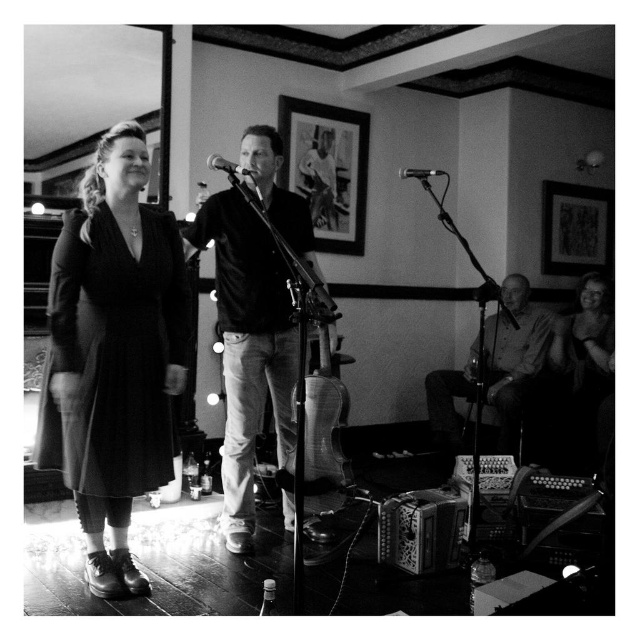
The height and width of the screenshot is (640, 640). What do you see at coordinates (326, 168) in the screenshot?
I see `printed paper picture frame at upper center` at bounding box center [326, 168].

The width and height of the screenshot is (640, 640). I want to click on printed paper picture frame at upper center, so click(326, 168).

How distant is matte black shirt at center from metallic silver picture frame at upper right?

A distance of 2.98 meters exists between matte black shirt at center and metallic silver picture frame at upper right.

Is matte black shirt at center to the right of metallic silver picture frame at upper right from the viewer's perspective?

In fact, matte black shirt at center is to the left of metallic silver picture frame at upper right.

Find the location of a particular element. matte black shirt at center is located at coordinates (248, 348).

Identify the location of matte black shirt at center. This screenshot has height=640, width=640. (248, 348).

Is matte black shirt at center wider than metallic silver microphone at center?

Yes.

The width and height of the screenshot is (640, 640). In order to click on matte black shirt at center in this screenshot , I will do `click(248, 348)`.